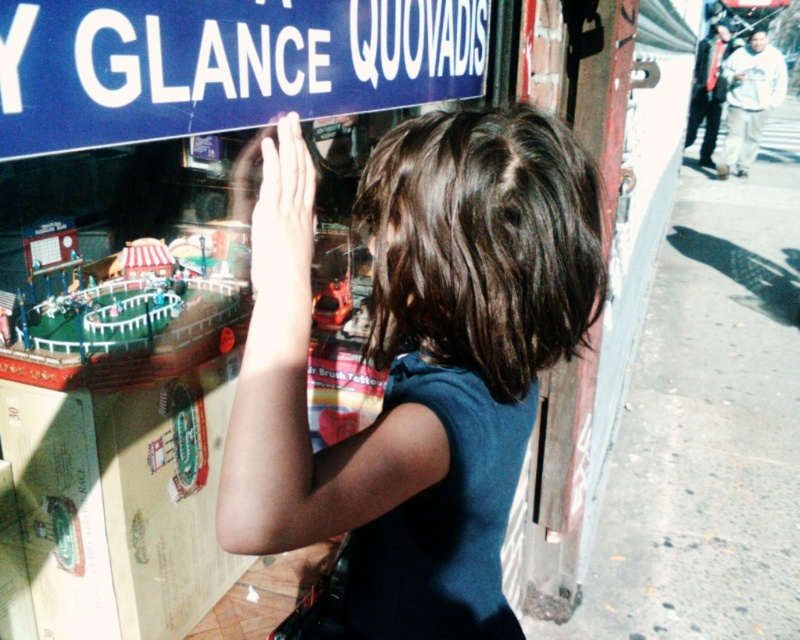
Between dark blue fabric at center and blue plastic sign at upper center, which one is positioned lower?

Positioned lower is dark blue fabric at center.

Does dark blue fabric at center have a greater height compared to blue plastic sign at upper center?

Correct, dark blue fabric at center is much taller as blue plastic sign at upper center.

Where is `dark blue fabric at center`? dark blue fabric at center is located at coordinates (416, 362).